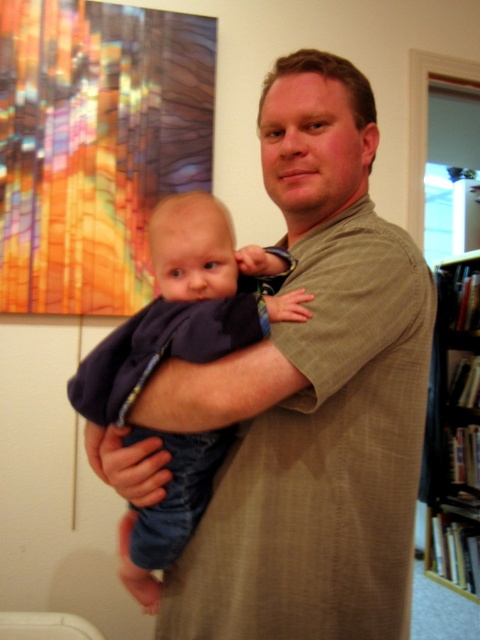
You are a photographer setting up a shoot in this home scene. You need to place a small prop between the matte khaki shirt at center and the dark blue fabric at center so it can be seen clearly by the camera. Based on their sizes, where should you position the prop?

Since the matte khaki shirt at center is much taller than the dark blue fabric at center, you should place the prop between them at the lower part near the dark blue fabric at center to ensure it is visible.

You are a photographer setting up a shoot in this room. You need to position a light source so that it illuminates both the dark blue fabric at center and the black wood bookshelf at right without casting shadows on the painting behind them. Based on their positions, where should you place the light source relative to these objects?

The dark blue fabric at center is located above the black wood bookshelf at right. To avoid casting shadows on the painting behind them, the light source should be placed above and in front of both objects, ensuring that light falls directly onto them while minimizing shadow projection onto the background.